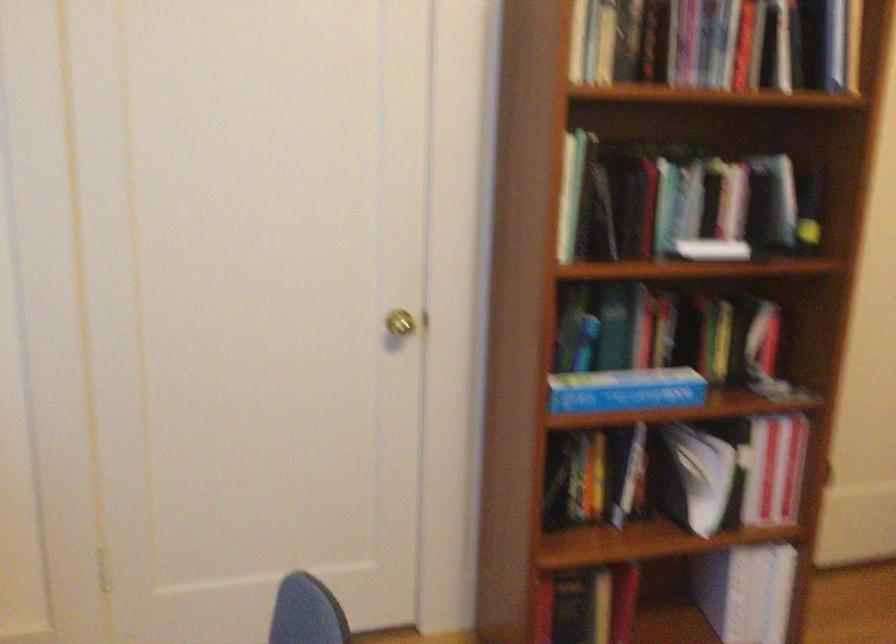
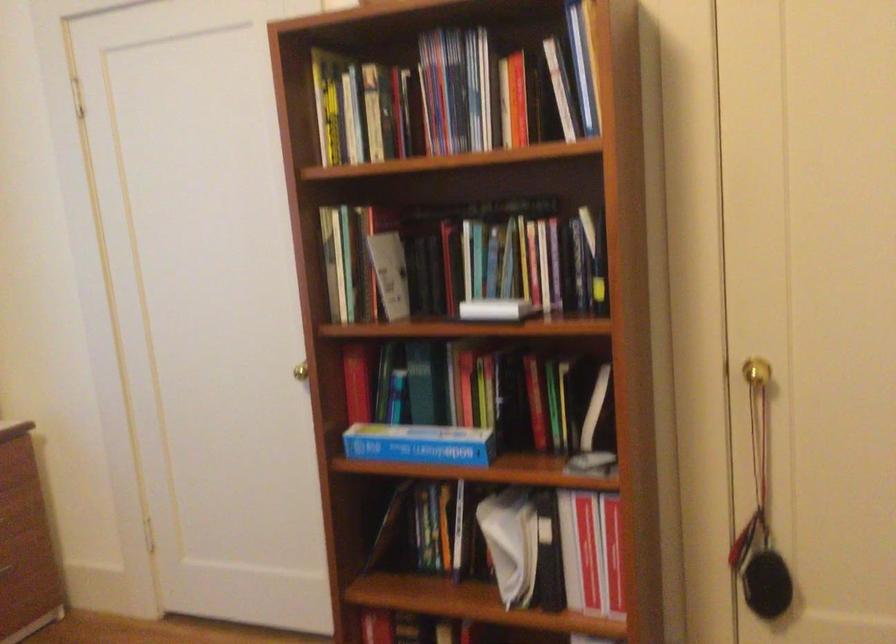
The point at (x=634, y=389) is marked in the first image. Where is the corresponding point in the second image?

(419, 444)